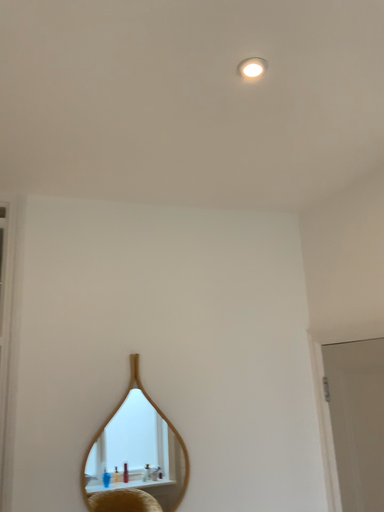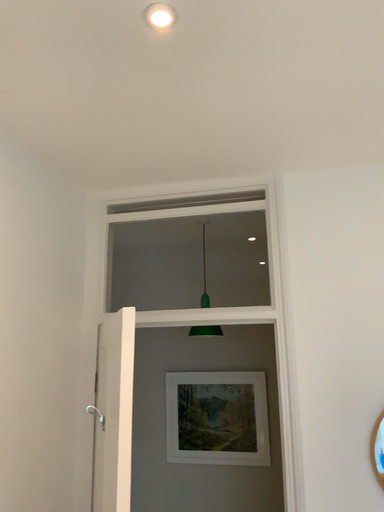
Question: How did the camera likely rotate when shooting the video?

Choices:
 (A) rotated right
 (B) rotated left

Answer: (B)